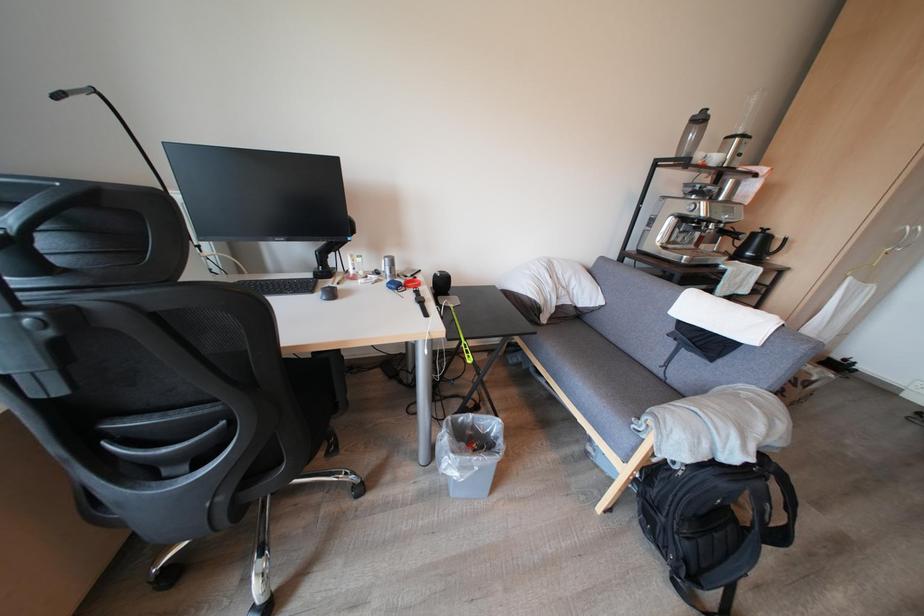
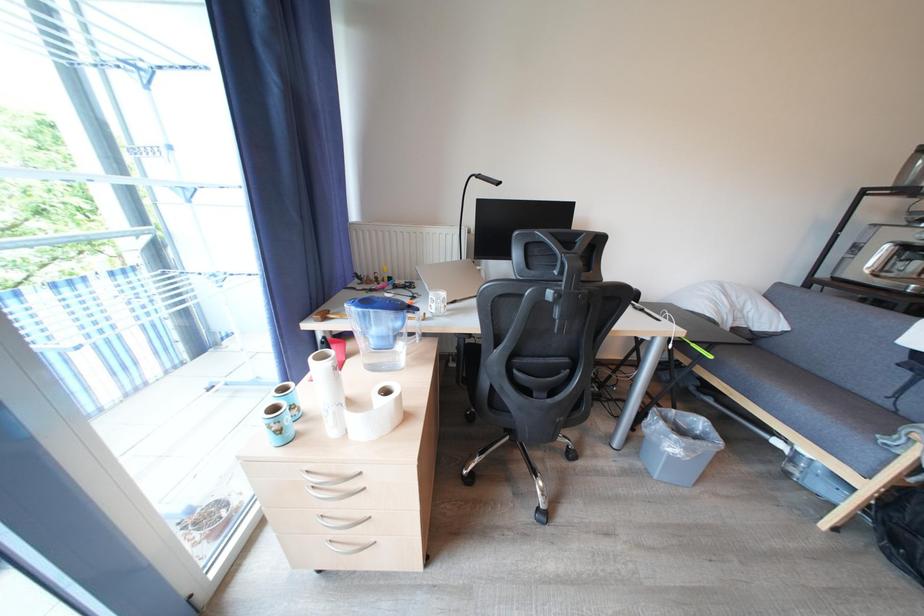
Question: The images are taken continuously from a first-person perspective. In which direction is your viewpoint rotating?

Choices:
 (A) Left
 (B) Right
 (C) Up
 (D) Down

Answer: (A)